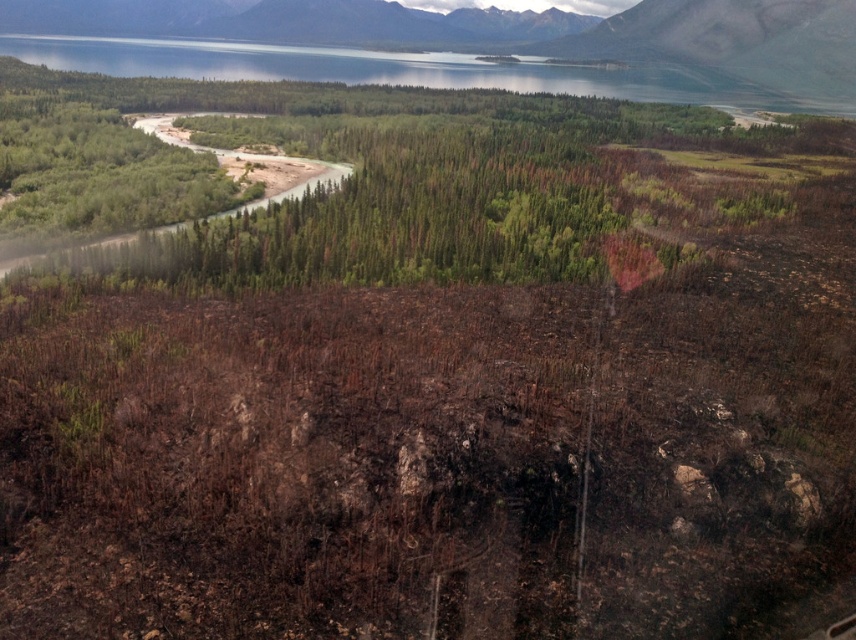
Question: In this image, where is green matte forest at upper center located relative to brown textured ground at upper center?

Choices:
 (A) below
 (B) above

Answer: (A)

Question: Among these points, which one is nearest to the camera?

Choices:
 (A) (74, 33)
 (B) (146, 84)

Answer: (B)

Question: Which object is farther from the camera taking this photo?

Choices:
 (A) brown textured ground at upper center
 (B) green matte forest at upper center

Answer: (A)

Question: Is green matte forest at upper center smaller than brown textured ground at upper center?

Choices:
 (A) yes
 (B) no

Answer: (B)

Question: Which object appears closest to the camera in this image?

Choices:
 (A) brown textured ground at upper center
 (B) green matte forest at upper center

Answer: (B)

Question: Does green matte forest at upper center lie in front of brown textured ground at upper center?

Choices:
 (A) no
 (B) yes

Answer: (B)